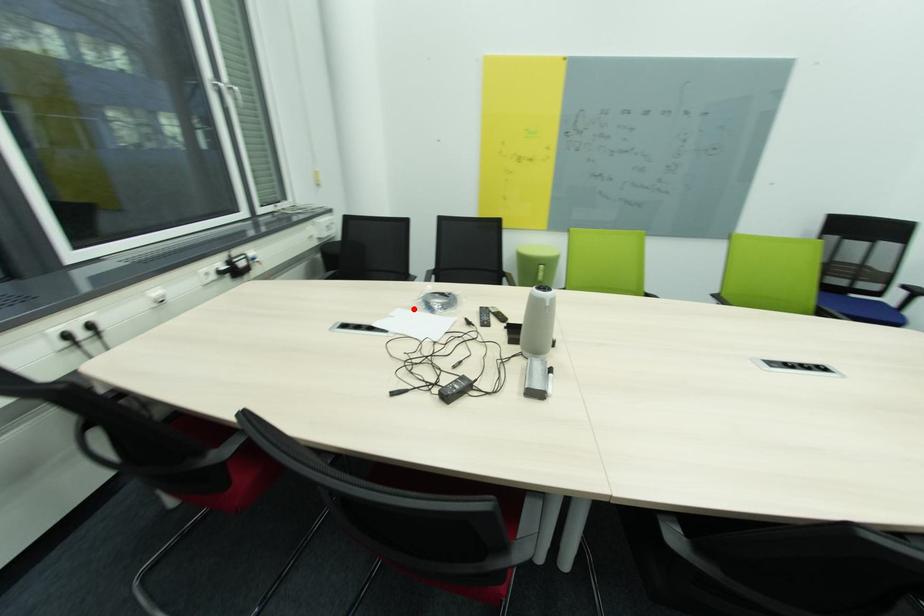
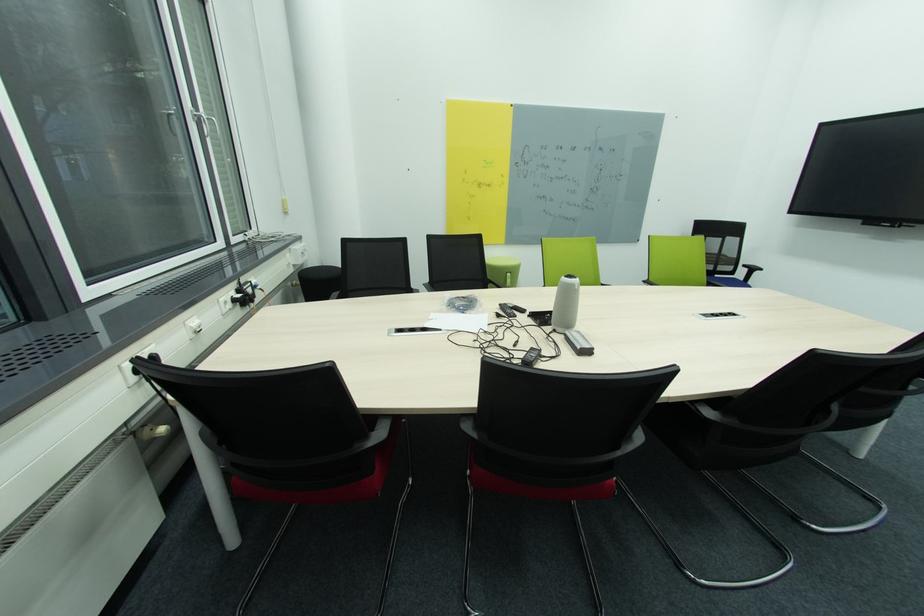
Where in the second image is the point corresponding to the highlighted location from the first image?

(444, 313)